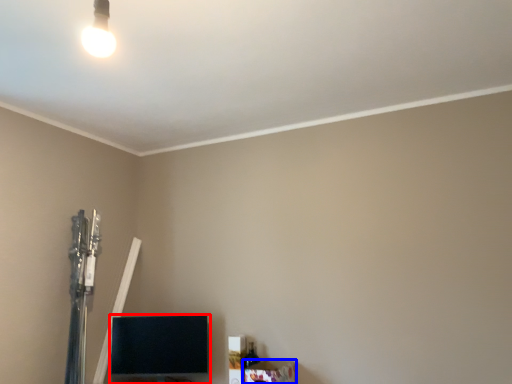
Question: Which object is closer to the camera taking this photo, furniture (highlighted by a red box) or furniture (highlighted by a blue box)?

Choices:
 (A) furniture
 (B) furniture

Answer: (B)